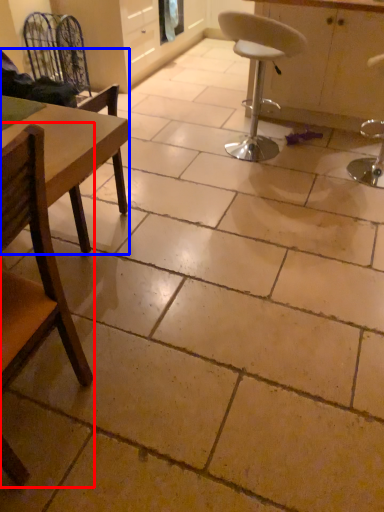
Question: Which point is closer to the camera, chair (highlighted by a red box) or chair (highlighted by a blue box)?

Choices:
 (A) chair
 (B) chair

Answer: (A)